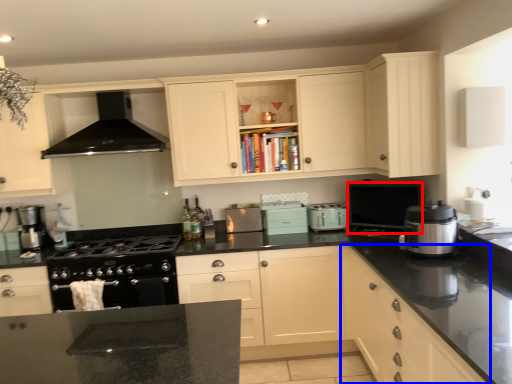
Question: Which object appears farthest to the camera in this image, appliance (highlighted by a red box) or cabinetry (highlighted by a blue box)?

Choices:
 (A) appliance
 (B) cabinetry

Answer: (A)